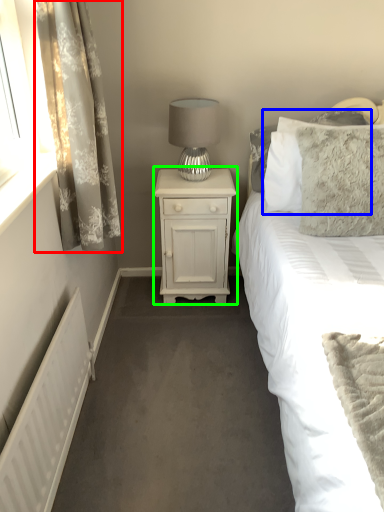
Question: Which object is positioned farthest from curtain (highlighted by a red box)? Select from pillow (highlighted by a blue box) and nightstand (highlighted by a green box).

Choices:
 (A) pillow
 (B) nightstand

Answer: (A)